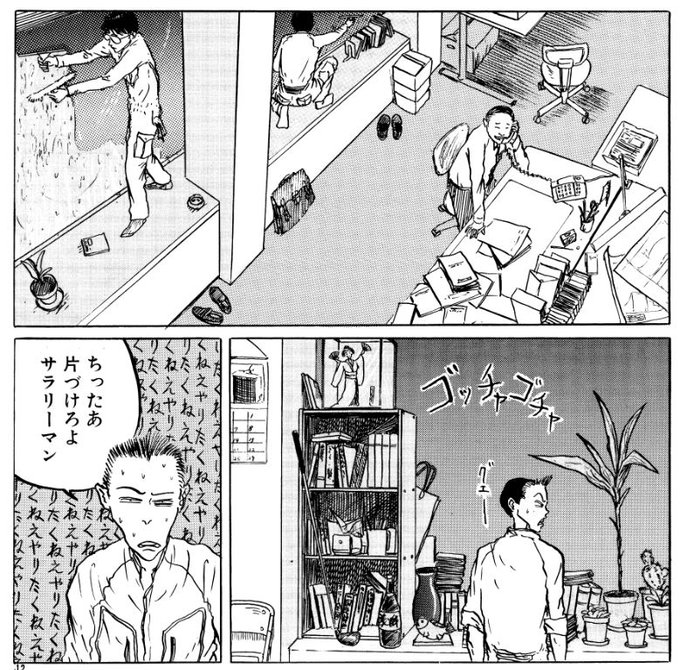
Where is `plant`? The height and width of the screenshot is (670, 680). plant is located at coordinates (660, 592), (638, 622), (622, 584), (593, 618), (45, 277).